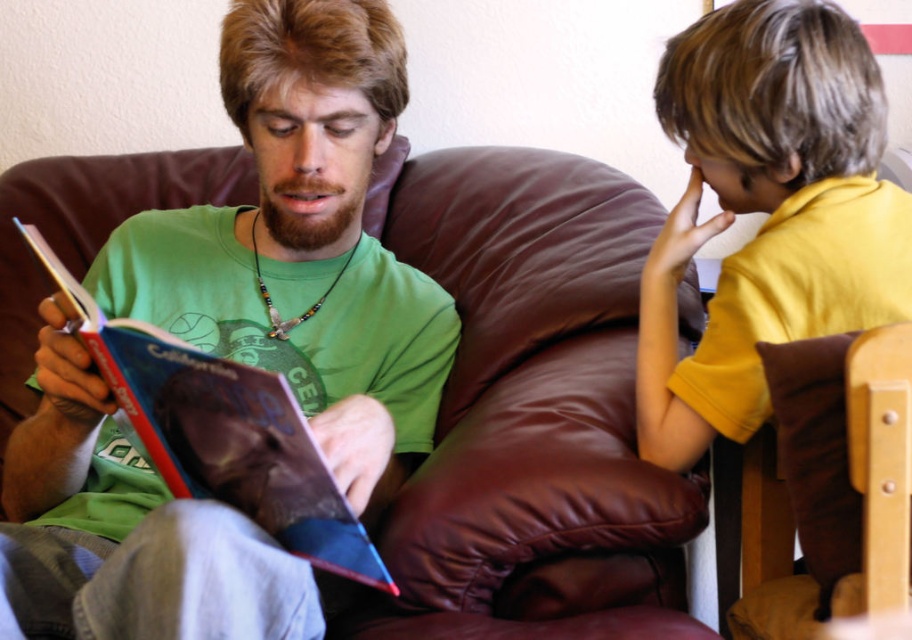
Question: Among these objects, which one is nearest to the camera?

Choices:
 (A) yellow matte shirt at upper right
 (B) brown leather couch at center

Answer: (B)

Question: Which point appears closest to the camera in this image?

Choices:
 (A) (838, 276)
 (B) (448, 612)

Answer: (A)

Question: Can you confirm if yellow matte shirt at upper right is positioned below hardcover book at left?

Choices:
 (A) yes
 (B) no

Answer: (B)

Question: Which point is farther to the camera?

Choices:
 (A) brown leather couch at center
 (B) hardcover book at left
 (C) yellow matte shirt at upper right

Answer: (C)

Question: Is brown leather couch at center smaller than hardcover book at left?

Choices:
 (A) no
 (B) yes

Answer: (A)

Question: Does brown leather couch at center have a lesser width compared to yellow matte shirt at upper right?

Choices:
 (A) no
 (B) yes

Answer: (A)